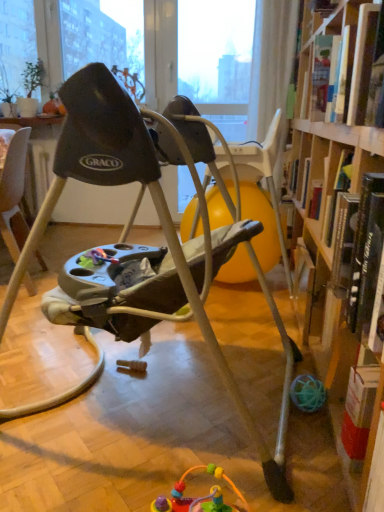
Question: Is hardcover book at right, which appears as the second book when viewed from the top, to the right of hardcover book at upper right, which ranks as the 2th book in bottom-to-top order, from the viewer's perspective?

Choices:
 (A) yes
 (B) no

Answer: (B)

Question: Is the depth of hardcover book at right, which appears as the second book when viewed from the top, greater than that of hardcover book at upper right, which ranks as the 2th book in bottom-to-top order?

Choices:
 (A) no
 (B) yes

Answer: (A)

Question: Considering the relative sizes of hardcover book at right, which is counted as the first book, starting from the bottom, and hardcover book at upper right, which ranks as the 1th book in top-to-bottom order, in the image provided, is hardcover book at right, which is counted as the first book, starting from the bottom, wider than hardcover book at upper right, which ranks as the 1th book in top-to-bottom order,?

Choices:
 (A) no
 (B) yes

Answer: (B)

Question: From the image's perspective, is hardcover book at right, which is counted as the first book, starting from the bottom, over hardcover book at upper right, which ranks as the 2th book in bottom-to-top order?

Choices:
 (A) no
 (B) yes

Answer: (A)

Question: Can hardcover book at upper right, which ranks as the 1th book in top-to-bottom order, be found inside hardcover book at right, which appears as the second book when viewed from the top?

Choices:
 (A) yes
 (B) no

Answer: (B)

Question: Considering the positions of gray plastic baby swing at center and hardcover book at upper right, which ranks as the 1th book in top-to-bottom order, in the image, is gray plastic baby swing at center bigger or smaller than hardcover book at upper right, which ranks as the 1th book in top-to-bottom order,?

Choices:
 (A) big
 (B) small

Answer: (A)

Question: From the image's perspective, is gray plastic baby swing at center above or below hardcover book at upper right, which ranks as the 2th book in bottom-to-top order?

Choices:
 (A) above
 (B) below

Answer: (B)

Question: Relative to hardcover book at upper right, which ranks as the 1th book in top-to-bottom order, is gray plastic baby swing at center in front or behind?

Choices:
 (A) behind
 (B) front

Answer: (B)

Question: Is point (168, 231) positioned closer to the camera than point (334, 30)?

Choices:
 (A) farther
 (B) closer

Answer: (B)

Question: In the image, is gray plastic baby swing at center positioned in front of or behind hardcover book at right, which appears as the second book when viewed from the top?

Choices:
 (A) front
 (B) behind

Answer: (A)

Question: From a real-world perspective, is gray plastic baby swing at center above or below hardcover book at right, which is counted as the first book, starting from the bottom?

Choices:
 (A) above
 (B) below

Answer: (B)

Question: Considering the positions of gray plastic baby swing at center and hardcover book at right, which is counted as the first book, starting from the bottom, in the image, is gray plastic baby swing at center taller or shorter than hardcover book at right, which is counted as the first book, starting from the bottom,?

Choices:
 (A) tall
 (B) short

Answer: (A)

Question: Considering the relative positions of gray plastic baby swing at center and hardcover book at right, which appears as the second book when viewed from the top, in the image provided, is gray plastic baby swing at center to the left or to the right of hardcover book at right, which appears as the second book when viewed from the top,?

Choices:
 (A) right
 (B) left

Answer: (B)

Question: From a real-world perspective, relative to hardcover book at right, which appears as the second book when viewed from the top, is hardcover book at upper right, which ranks as the 1th book in top-to-bottom order, vertically above or below?

Choices:
 (A) below
 (B) above

Answer: (B)

Question: Which is correct: hardcover book at upper right, which ranks as the 1th book in top-to-bottom order, is inside hardcover book at right, which appears as the second book when viewed from the top, or outside of it?

Choices:
 (A) outside
 (B) inside

Answer: (A)